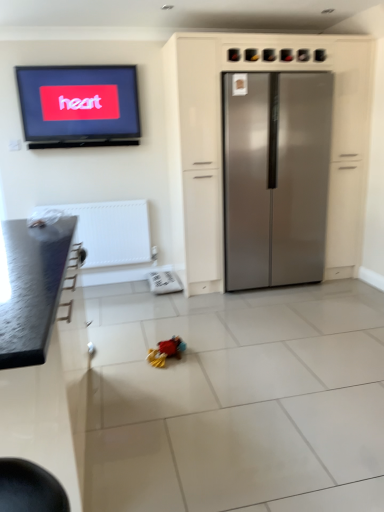
Question: Is satin silver refrigerator at center to the left or to the right of plush multicolored toy at center in the image?

Choices:
 (A) left
 (B) right

Answer: (B)

Question: Considering the positions of point (223, 121) and point (152, 356), is point (223, 121) closer or farther from the camera than point (152, 356)?

Choices:
 (A) closer
 (B) farther

Answer: (B)

Question: Which is nearer to the plush multicolored toy at center?

Choices:
 (A) stainless steel refrigerator at center, which appears as the first cabinetry when viewed from the back
 (B) matte black television at upper left
 (C) satin silver refrigerator at center
 (D) granite countertop at left, which ranks as the first cabinetry in left-to-right order
 (E) white textured radiator at lower left

Answer: (D)

Question: Which object is the farthest from the matte black television at upper left?

Choices:
 (A) satin silver refrigerator at center
 (B) granite countertop at left, the 2th cabinetry from the right
 (C) stainless steel refrigerator at center, which appears as the 1th cabinetry when viewed from the right
 (D) white textured radiator at lower left
 (E) plush multicolored toy at center

Answer: (E)